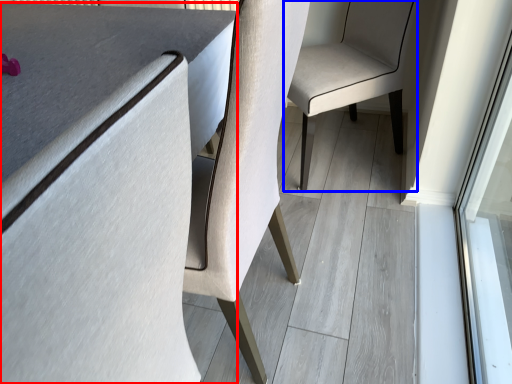
Question: Which point is further to the camera, table (highlighted by a red box) or chair (highlighted by a blue box)?

Choices:
 (A) table
 (B) chair

Answer: (B)